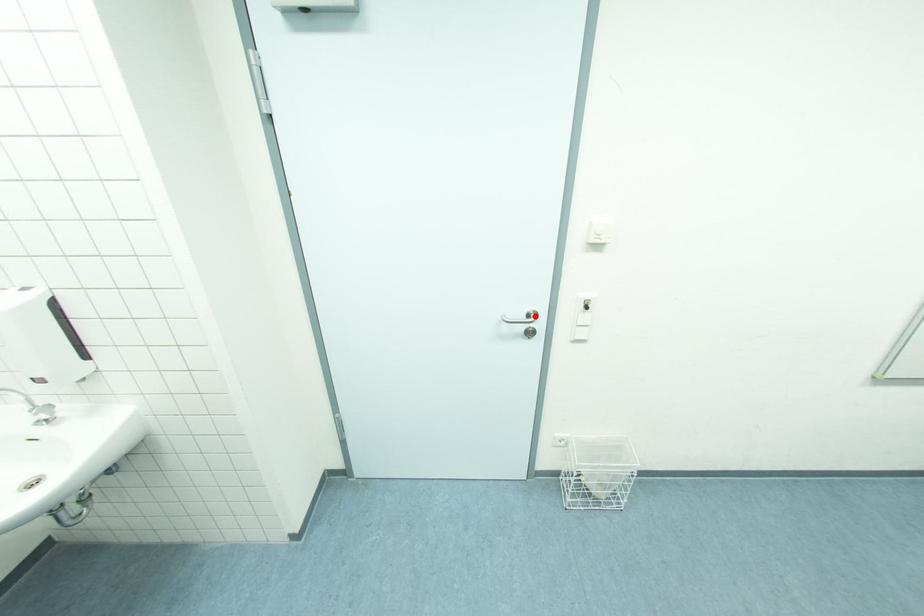
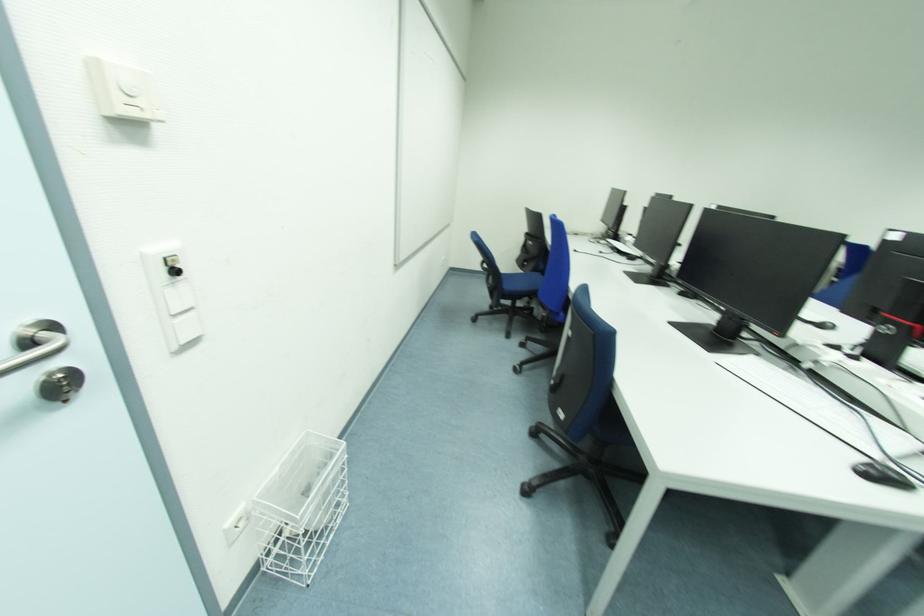
Where in the second image is the point corresponding to the highlighted location from the first image?

(50, 334)